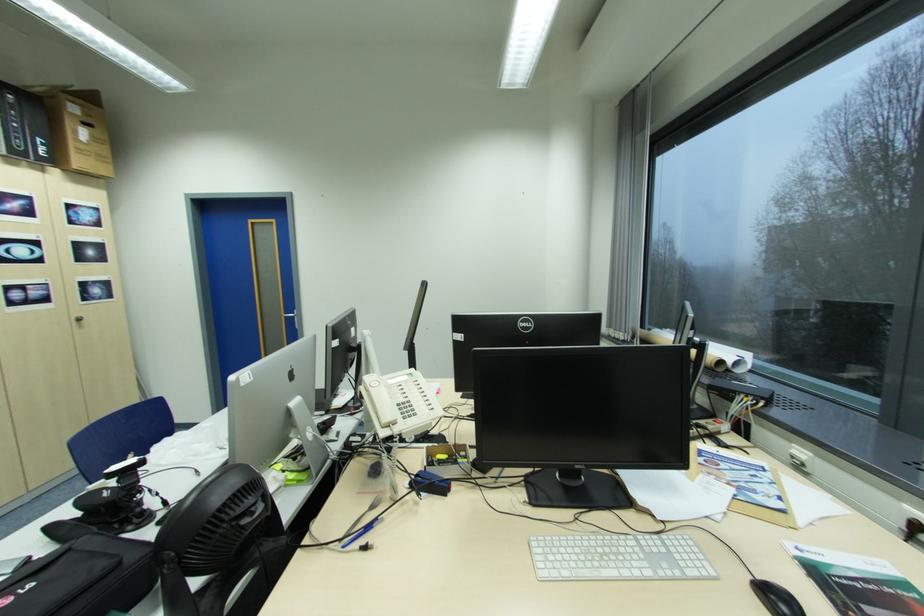
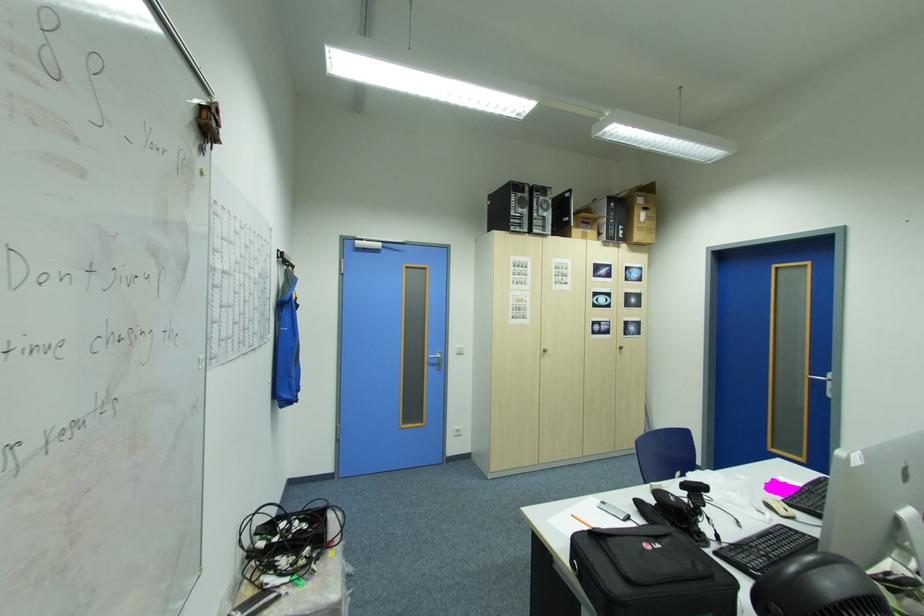
Where in the second image is the point corresponding to (x=81, y=103) from the first image?

(648, 198)